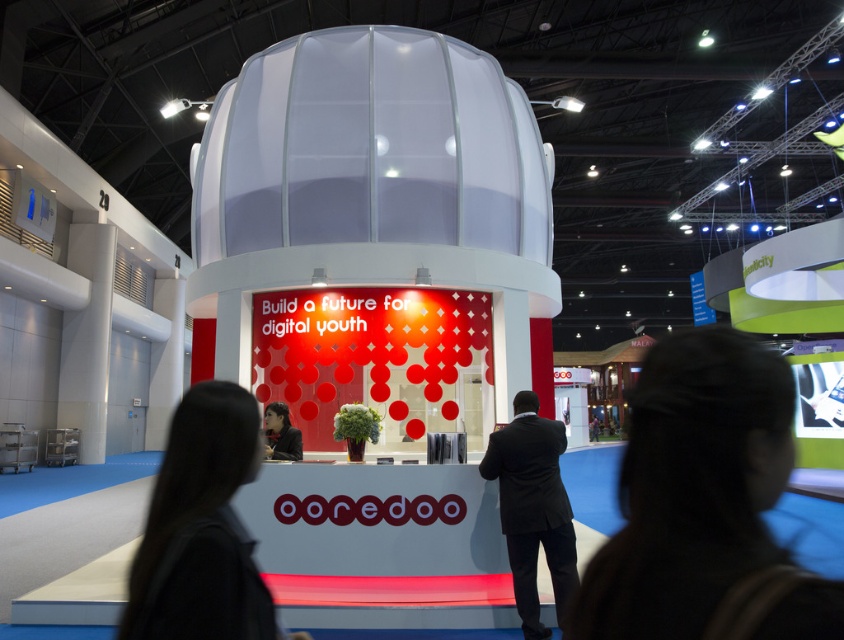
You are a visitor at the exhibition and want to interact with the matte black laptop at center. Based on its position, can you estimate how far it is from the edge of the booth?

The matte black laptop at center is located at point coordinates approximately 0.786 on the x and 0.833 on the y axis. Since these coordinates are close to 1, it suggests the laptop is near the edge of the booth. However, without knowing the exact dimensions of the booth or the coordinate system used, an accurate distance cannot be determined. Please check the booth layout map for precise measurements.

You are a photographer standing at the entrance of the exhibition hall. You want to take a photo of the black suit at center so that it fills the frame without cropping any part of it. Your camera has a maximum zoom range of 100mm. Knowing that the recommended framing distance for this setup is 4 meters, can you capture the shot as desired?

The black suit at center is 3.91 meters away from the camera. Since the recommended framing distance is 4 meters, the photographer can slightly adjust their position to maintain the required distance and successfully capture the shot without cropping.

You are an attendee at the trade show and want to pick up the matte black jacket at center. However, there is a matte black desk at center in the way. Can you reach the jacket without moving the desk?

The matte black desk at center is located above the matte black jacket at center, so the desk is blocking access to the jacket. You would need to move the desk to reach the jacket.